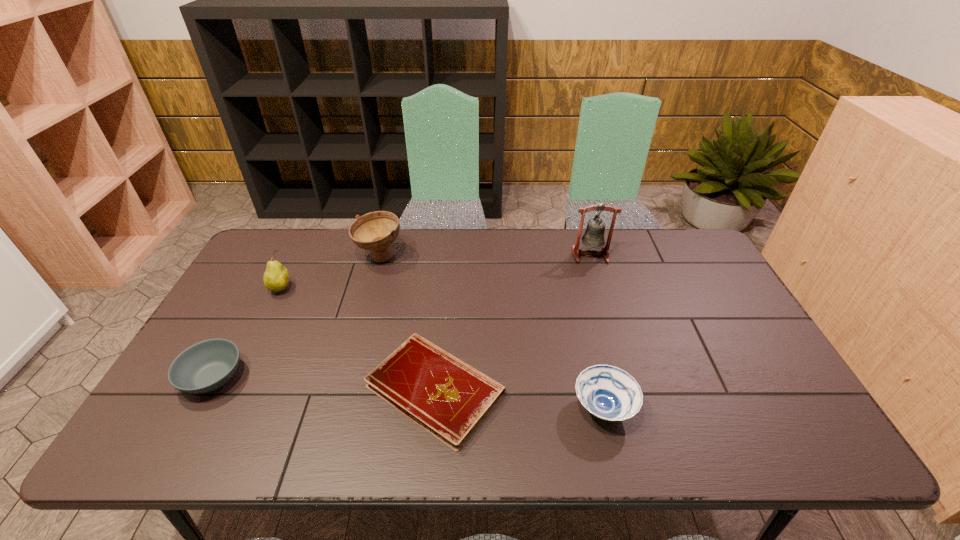
Where is `the closest soup bowl to the leftmost soup bowl`? the closest soup bowl to the leftmost soup bowl is located at coordinates (376, 231).

Image resolution: width=960 pixels, height=540 pixels. Find the location of `vacant space that satisfies the following two spatial constraints: 1. on the back side of the tallest object; 2. on the left side of the tallest soup bowl`. vacant space that satisfies the following two spatial constraints: 1. on the back side of the tallest object; 2. on the left side of the tallest soup bowl is located at coordinates (380, 255).